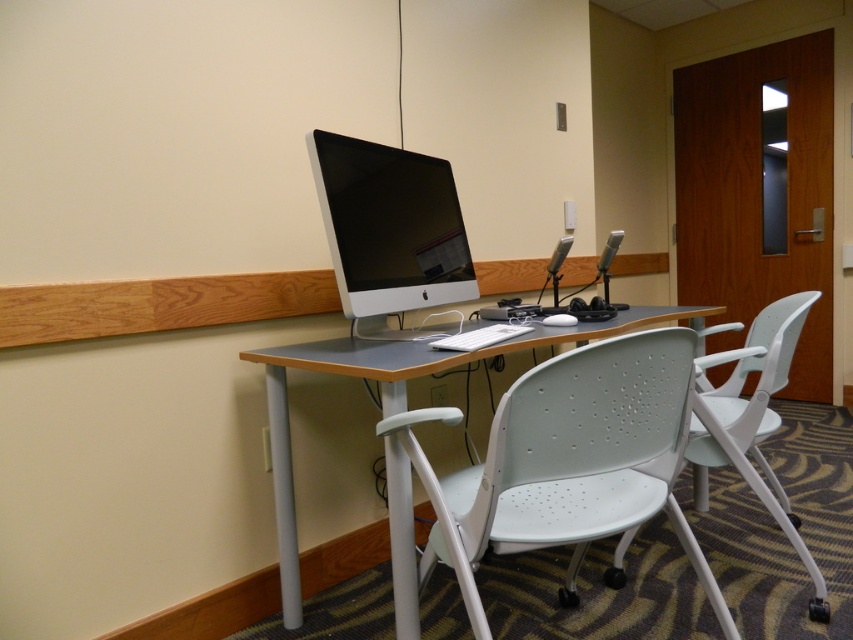
You are a delivery person standing in front of the workspace. You need to place a package that is 1.5 meters long on the floor between you and the matte gray desk at center. Is there enough space for the package to fit without overlapping the desk?

The distance between the matte gray desk at center and the viewer is 1.25 meters. Since the package is 1.5 meters long, it would not fit as it is longer than the available space.

You are a technician who needs to adjust the height of the satin black monitor at center. The monitor stand can extend up to 5 feet. Can you reach the monitor from your current position without moving closer?

The satin black monitor at center is 5.05 feet away from the viewer. Since the monitor stand can extend up to 5 feet, it is 0.05 feet too far to reach comfortably. You may need to move closer or use a longer tool.